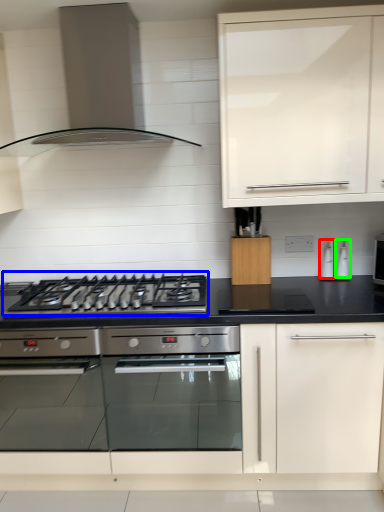
Question: Based on their relative distances, which object is farther from appliance (highlighted by a red box)? Choose from gas stove (highlighted by a blue box) and kitchen appliance (highlighted by a green box).

Choices:
 (A) gas stove
 (B) kitchen appliance

Answer: (A)